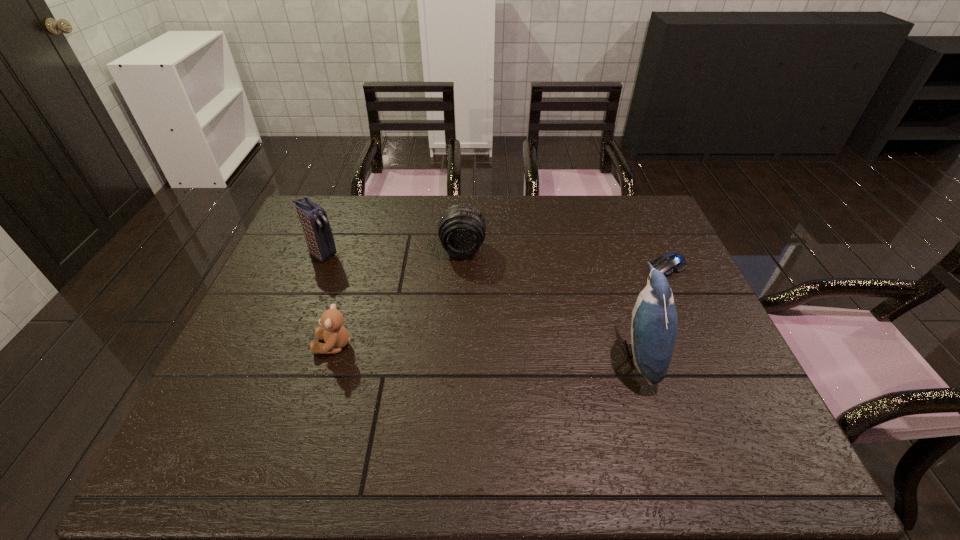
Image resolution: width=960 pixels, height=540 pixels. I want to click on the fourth object from right to left, so click(x=336, y=337).

Find the location of a particular element. The image size is (960, 540). the fourth tallest object is located at coordinates (336, 337).

Identify the location of the second object from right to left. The image size is (960, 540). (653, 331).

Where is `bird`? bird is located at coordinates (653, 331).

Locate an element on the screen. the shortest object is located at coordinates (671, 263).

Where is `the rightmost object`? the rightmost object is located at coordinates (671, 263).

In order to click on clutch bag in this screenshot , I will do `click(314, 221)`.

Where is `the leftmost object`? the leftmost object is located at coordinates (314, 221).

Locate an element on the screen. the third tallest object is located at coordinates (461, 229).

This screenshot has width=960, height=540. In order to click on the third object from left to right in this screenshot , I will do `click(461, 229)`.